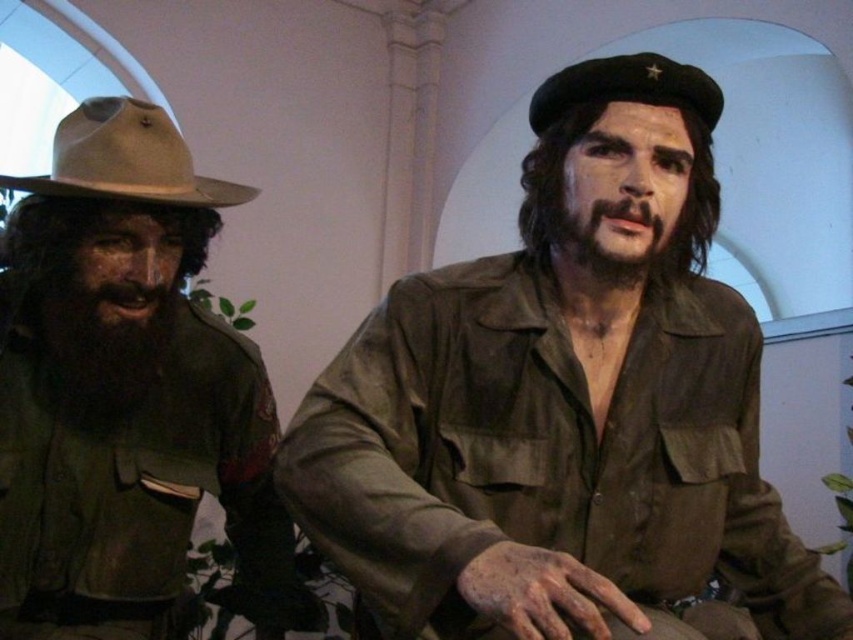
You are an interior designer assessing the placement of items in a museum exhibit. You notice the tan felt cowboy hat at left and the black felt beret at upper center. Which item is positioned lower in the scene?

The tan felt cowboy hat at left is located below the black felt beret at upper center, so the tan felt cowboy hat at left is positioned lower in the scene.

You are standing in the museum and want to walk towards both the point at coordinates point (117, 148) and the point at coordinates point (544, 131). Which point will you reach first?

You will reach point (117, 148) first because it is closer to you than point (544, 131), which is further away.

You are an interior designer assessing the placement of objects in a museum exhibit. You notice the matte green uniform at left. Based on its coordinates, is it positioned closer to the center of the room or the edge?

The matte green uniform at left is located at point 0.602 on the x and 0.149 on the y axis. Since the coordinates are closer to the edges of the room, it is positioned closer to the edge rather than the center.